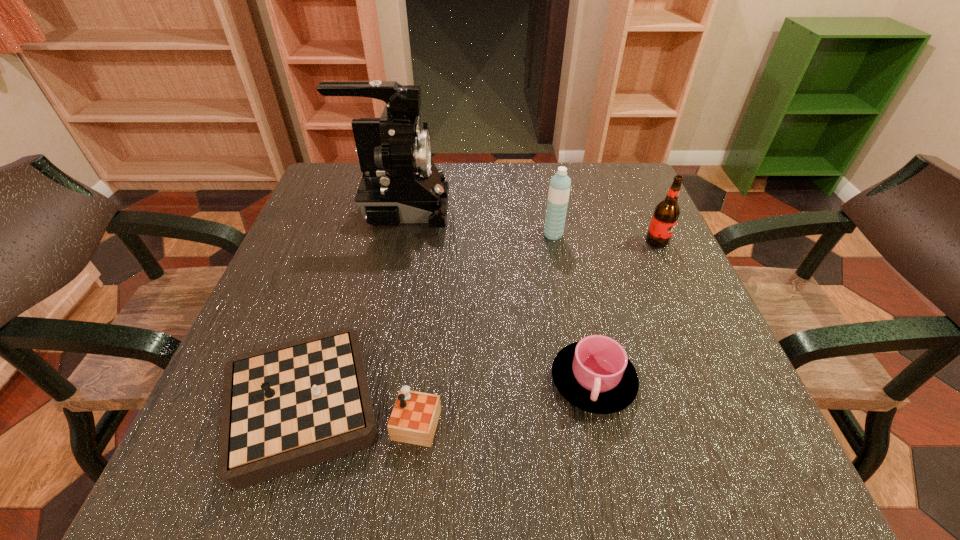
The image size is (960, 540). Find the location of `object that is at the far edge`. object that is at the far edge is located at coordinates (400, 183).

The image size is (960, 540). Identify the location of object situated at the near edge. (289, 406).

This screenshot has height=540, width=960. Find the location of `camcorder located at the left edge`. camcorder located at the left edge is located at coordinates (400, 183).

What are the coordinates of `chessboard that is at the left edge` in the screenshot? It's located at (289, 406).

Identify the location of object located in the right edge section of the desktop. This screenshot has width=960, height=540. (666, 213).

At what (x,y) coordinates should I click in order to perform the action: click on object at the far left corner. Please return your answer as a coordinate pair (x, y). The width and height of the screenshot is (960, 540). Looking at the image, I should click on (400, 183).

You are a GUI agent. You are given a task and a screenshot of the screen. Output one action in this format:
    pyautogui.click(x=<x>, y=<y>)
    Task: Click on the object that is at the near left corner
    
    Given the screenshot: What is the action you would take?
    pyautogui.click(x=289, y=406)

Find the location of `vacant point at the far edge`. vacant point at the far edge is located at coordinates (555, 172).

Identify the location of vacant space at the near edge of the desktop. The height and width of the screenshot is (540, 960). (455, 444).

This screenshot has height=540, width=960. In order to click on free space at the left edge of the desktop in this screenshot , I will do `click(353, 238)`.